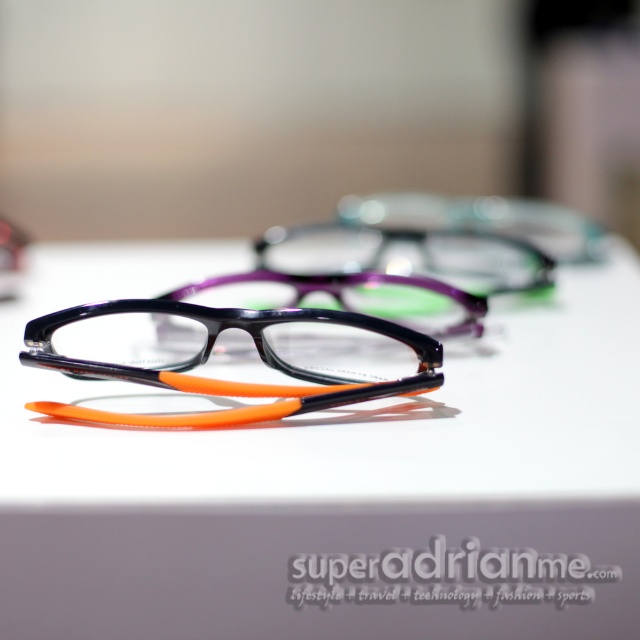
You are standing in an optical store and want to try on the matte black frame at center. If your arm is 3 feet long, can you reach it without moving closer?

The matte black frame at center is 3.40 feet away from the viewer. Since your arm is 3 feet long, you cannot reach it without moving closer.

You are an optician trying to organize the eyeglasses on the display. You need to place a new pair of glasses exactly at point (211, 348). Which existing glasses should you move to make space?

You should move the matte black frame at center located at point (211, 348) to make space for the new pair of glasses.

You are trying to determine which pair of glasses is taller between the matte black frame at center and the translucent orange plastic glasses at center. Based on the scene description, which one is taller?

The matte black frame at center is taller than the translucent orange plastic glasses at center according to the description.